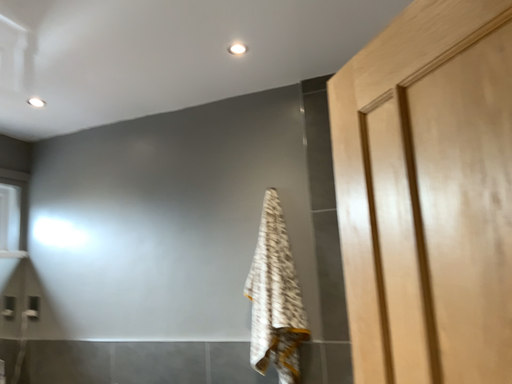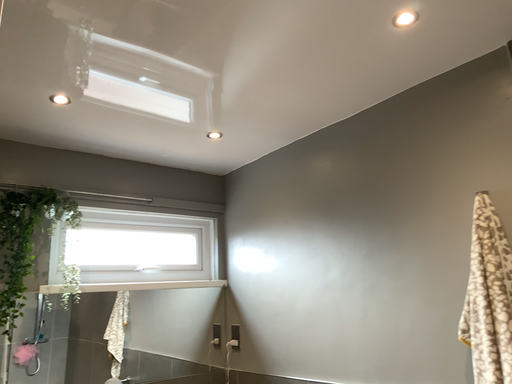
Question: How did the camera likely rotate when shooting the video?

Choices:
 (A) rotated left
 (B) rotated right

Answer: (A)